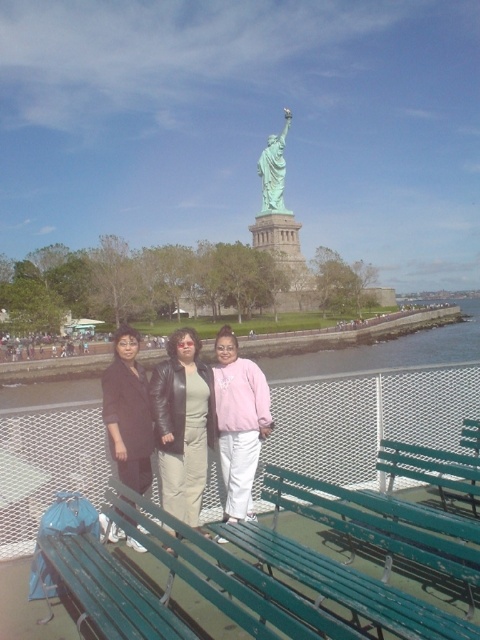
You are a photographer trying to capture a photo of the Statue of Liberty in the background. You notice the green painted metal bench at lower center and the pink fleece jacket at center. Which object is shorter in height?

The green painted metal bench at lower center is shorter in height compared to the pink fleece jacket at center.

You are standing at the point marked as point (371, 548) in the image. What object are you currently standing on?

The point (371, 548) is on the green painted metal bench at lower center.